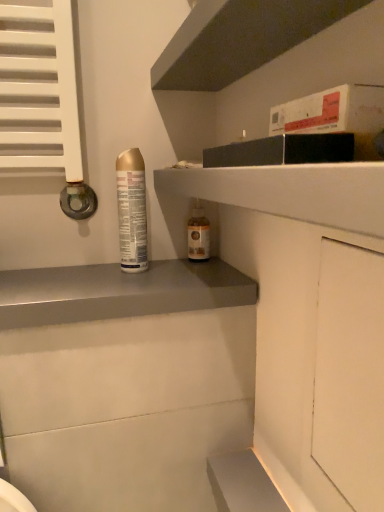
The width and height of the screenshot is (384, 512). What are the coordinates of `blank area to the left of gold metallic can at left, which ranks as the first bottle in front-to-back order` in the screenshot? It's located at (64, 276).